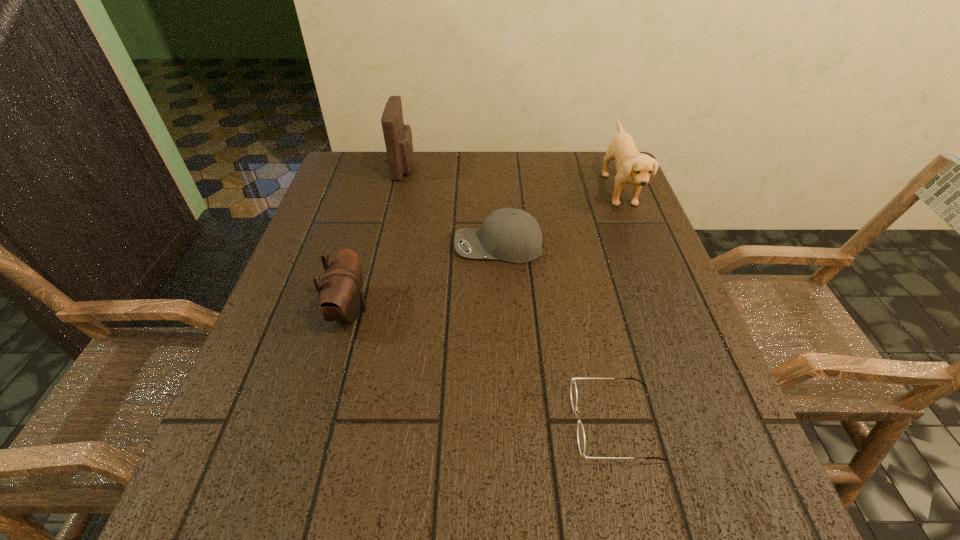
Where is `object that is the nearest to the puppy`? object that is the nearest to the puppy is located at coordinates (512, 235).

Locate which object ranks fourth in proximity to the nearer pouch. Please provide its 2D coordinates. Your answer should be formatted as a tuple, i.e. [(x, y)], where the tuple contains the x and y coordinates of a point satisfying the conditions above.

[(632, 167)]